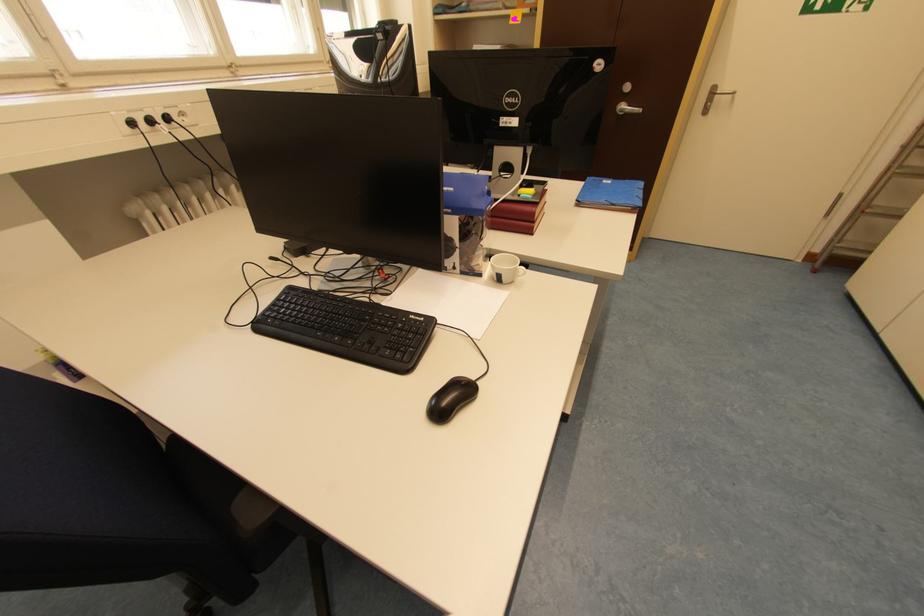
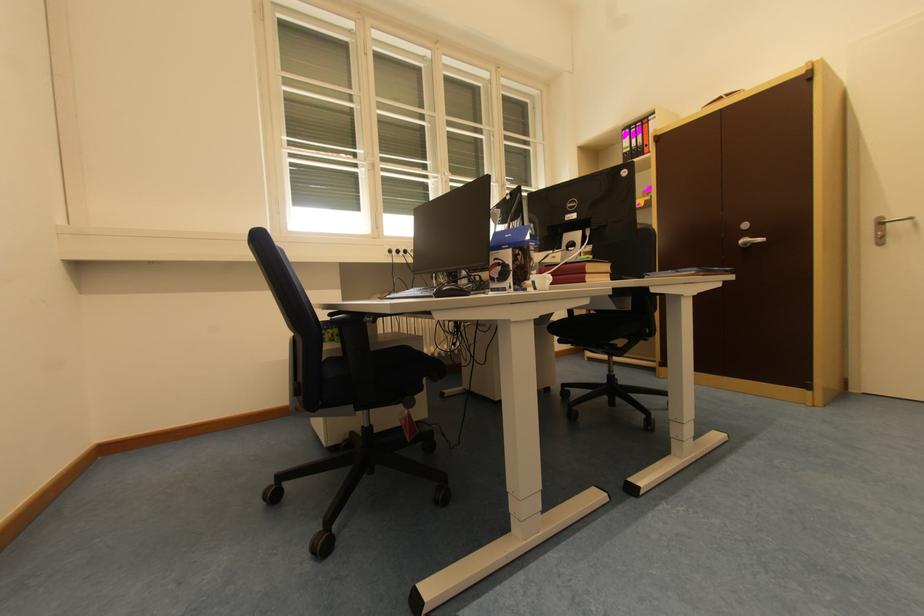
Locate, in the second image, the point that corresponds to [629,108] in the first image.

(752, 241)